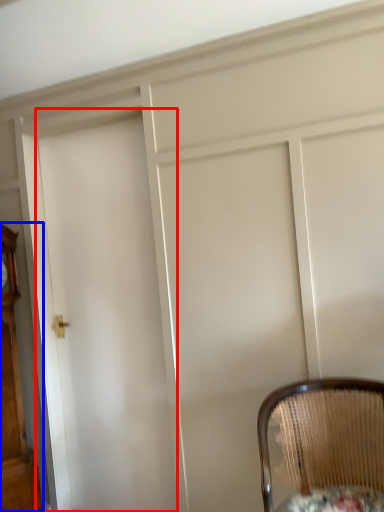
Question: Which object is closer to the camera taking this photo, door (highlighted by a red box) or furniture (highlighted by a blue box)?

Choices:
 (A) door
 (B) furniture

Answer: (B)